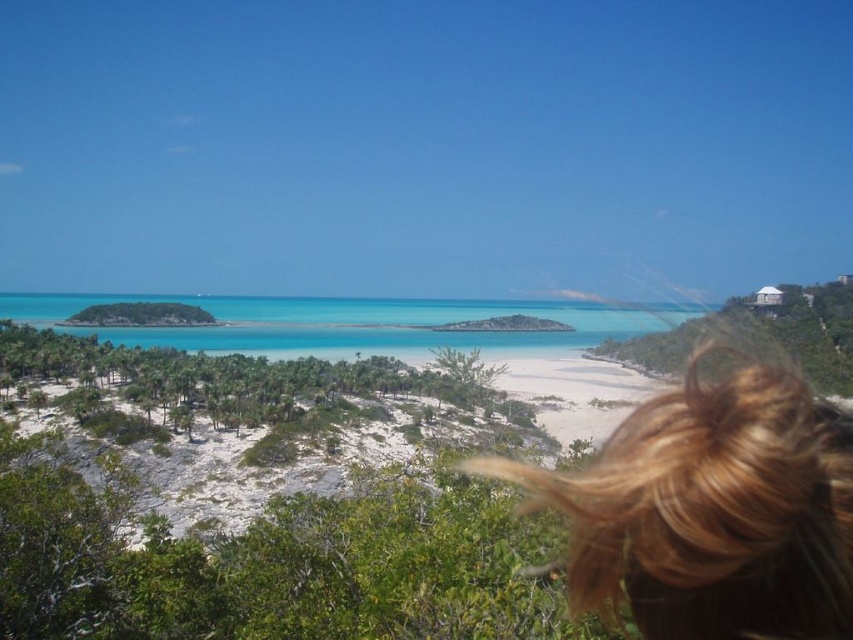
Question: Can you confirm if blonde hair at lower right is bigger than turquoise crystal clear water at center?

Choices:
 (A) yes
 (B) no

Answer: (B)

Question: Which point is closer to the camera?

Choices:
 (A) (x=782, y=404)
 (B) (x=323, y=330)

Answer: (A)

Question: Does blonde hair at lower right have a lesser width compared to turquoise crystal clear water at center?

Choices:
 (A) no
 (B) yes

Answer: (B)

Question: Which point is farther to the camera?

Choices:
 (A) (132, 339)
 (B) (697, 582)

Answer: (A)

Question: Can you confirm if blonde hair at lower right is smaller than turquoise crystal clear water at center?

Choices:
 (A) yes
 (B) no

Answer: (A)